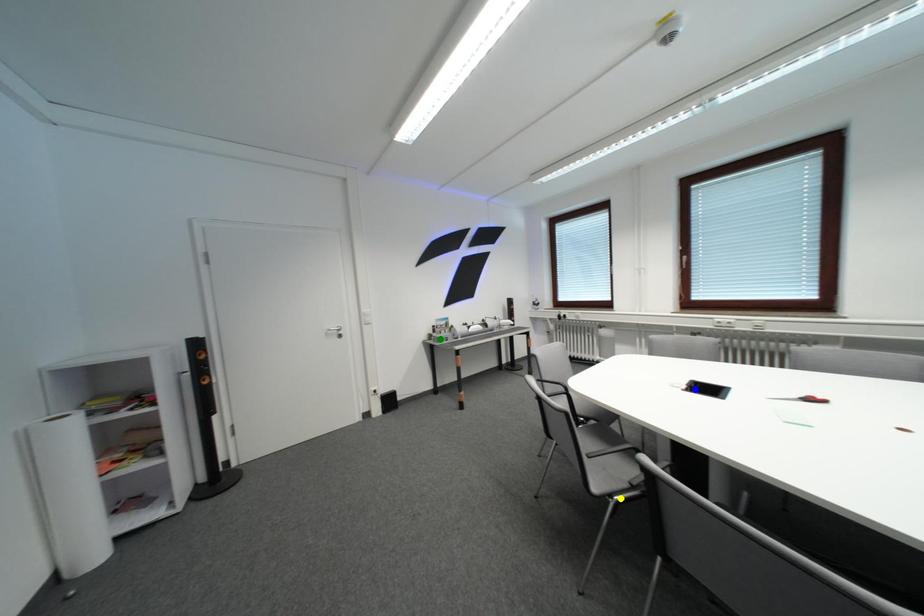
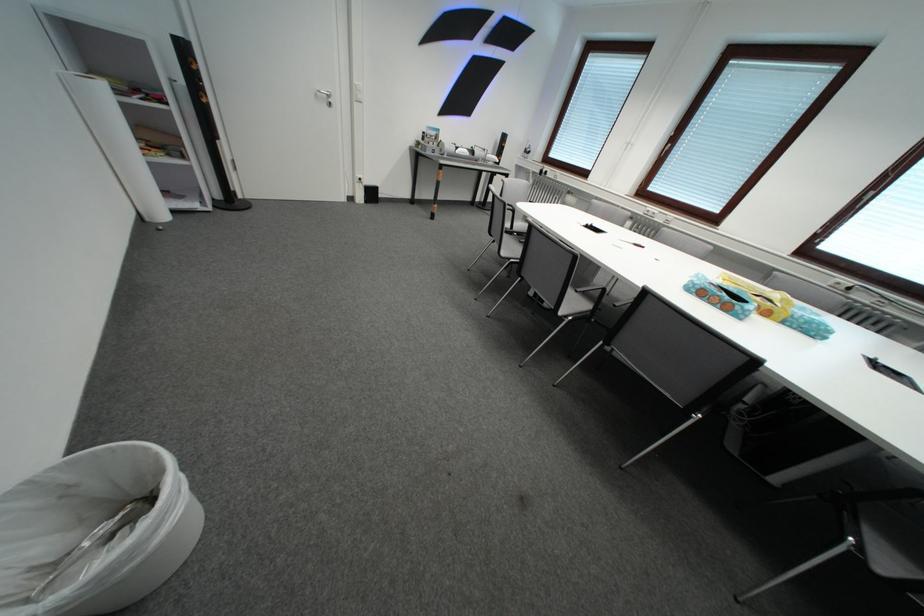
I am providing you with two images of the same scene from different viewpoints. Three points are marked in image1. Which point corresponds to a part or object that is occluded in image2?In image1, three points are marked. Which of them correspond to a part or object that is occluded in image2?Among the three points shown in image1, which one corresponds to a part or object that is no longer visible due to occlusion in image2?

blue point